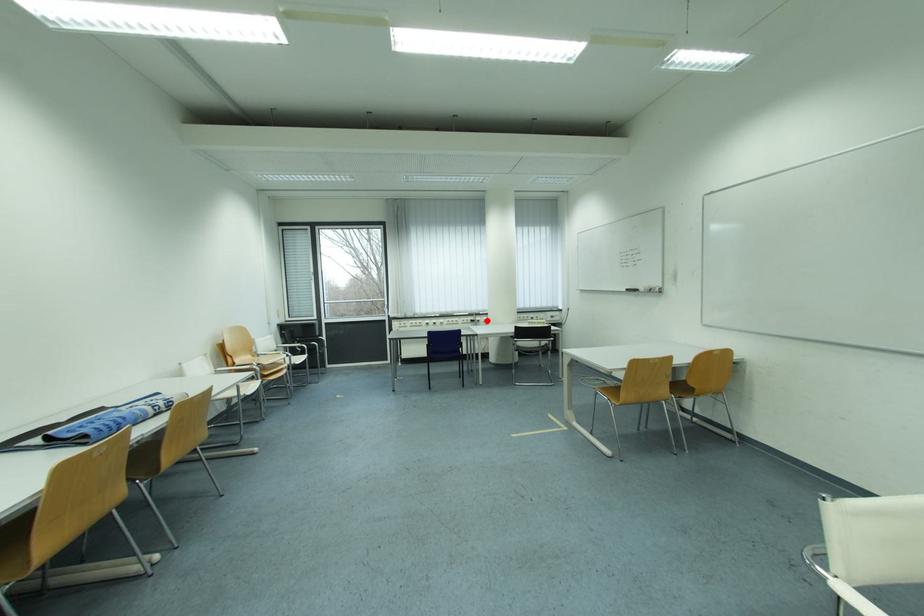
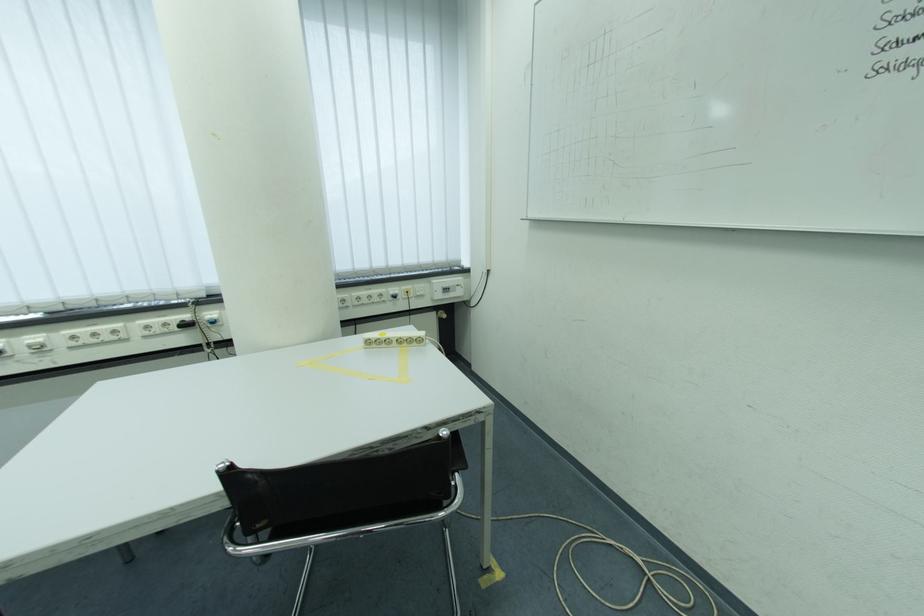
Locate, in the second image, the point that corresponds to the highlighted location in the first image.

(217, 315)